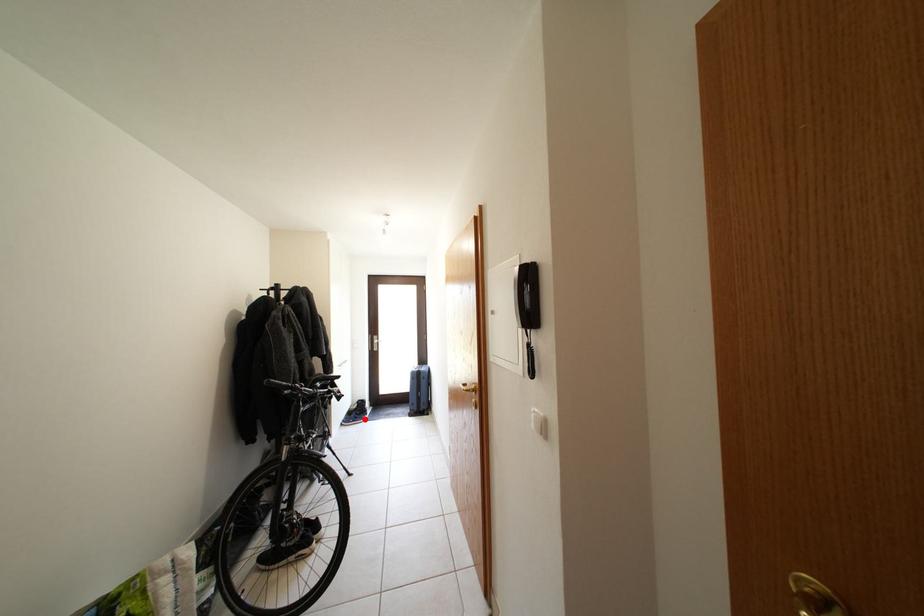
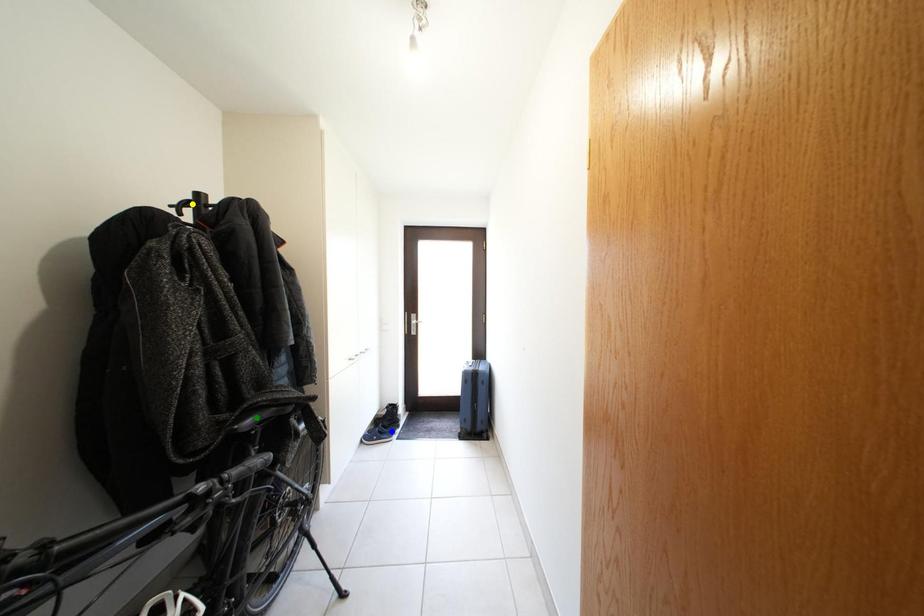
Question: I am providing you with two images of the same scene from different viewpoints. A red point is marked on the first image. You are given multiple points on the second image. Which point in image 2 is actually the same real-world point as the red point in image 1?

Choices:
 (A) blue point
 (B) green point
 (C) yellow point

Answer: (A)